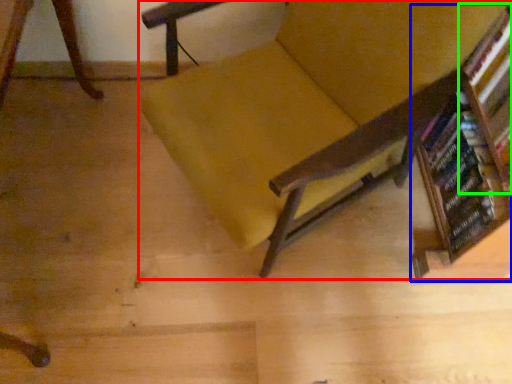
Question: Considering the real-world distances, which object is farthest from chair (highlighted by a red box)? bookcase (highlighted by a blue box) or shelf (highlighted by a green box)?

Choices:
 (A) bookcase
 (B) shelf

Answer: (B)